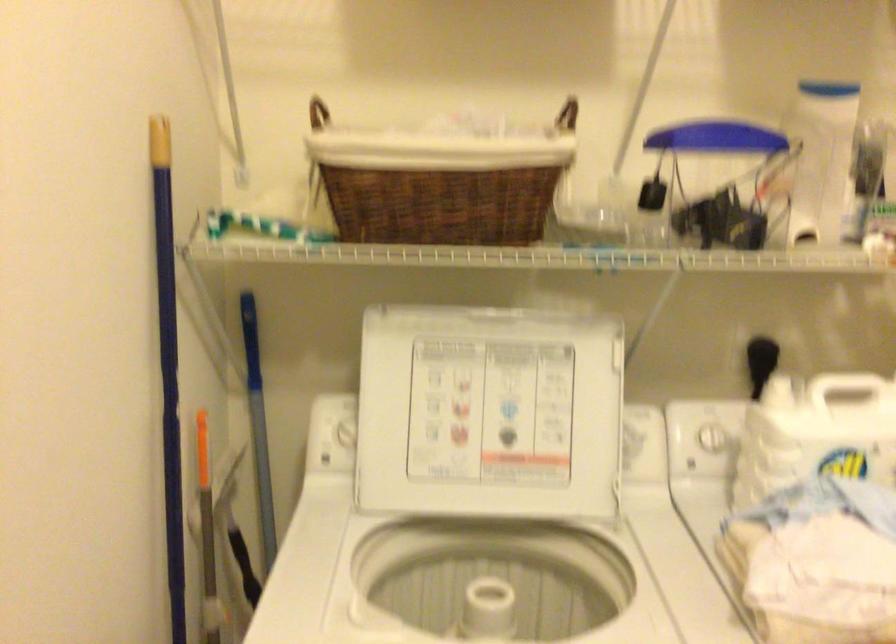
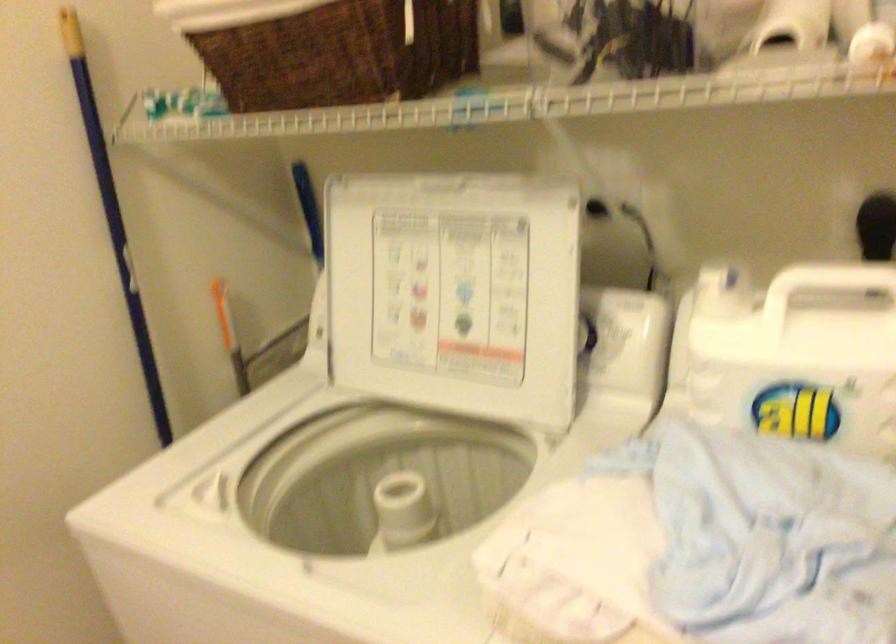
Find the pixel in the second image that matches (x=174, y=337) in the first image.

(113, 216)